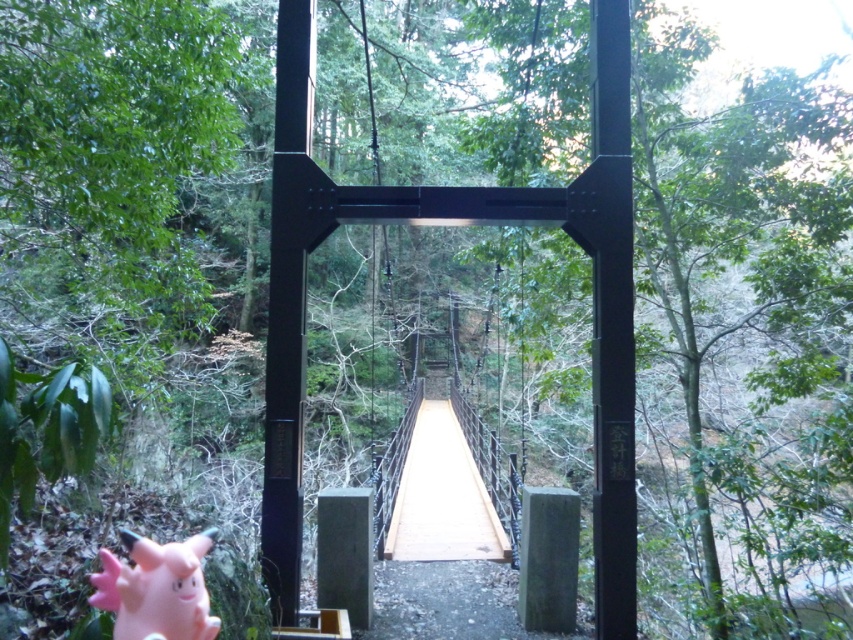
Question: Can you confirm if wooden bridge at center is positioned below pink rubber toy at lower left?

Choices:
 (A) no
 (B) yes

Answer: (B)

Question: Which point is closer to the camera taking this photo?

Choices:
 (A) (180, 566)
 (B) (432, 460)

Answer: (A)

Question: Which object appears farthest from the camera in this image?

Choices:
 (A) pink rubber toy at lower left
 (B) black metal suspension bridge at center
 (C) wooden bridge at center

Answer: (C)

Question: Does black metal suspension bridge at center appear under wooden bridge at center?

Choices:
 (A) yes
 (B) no

Answer: (B)

Question: Which point is farther from the camera taking this photo?

Choices:
 (A) [x=473, y=456]
 (B) [x=282, y=156]
 (C) [x=132, y=621]

Answer: (A)

Question: Does black metal suspension bridge at center appear under wooden bridge at center?

Choices:
 (A) yes
 (B) no

Answer: (B)